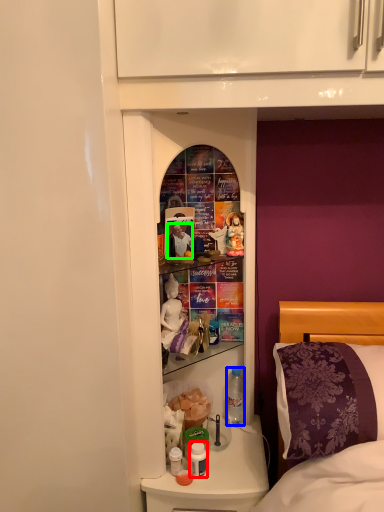
Question: Estimate the real-world distances between objects in this image. Which object is farther from bottle (highlighted by a red box), bottle (highlighted by a blue box) or person (highlighted by a green box)?

Choices:
 (A) bottle
 (B) person

Answer: (B)